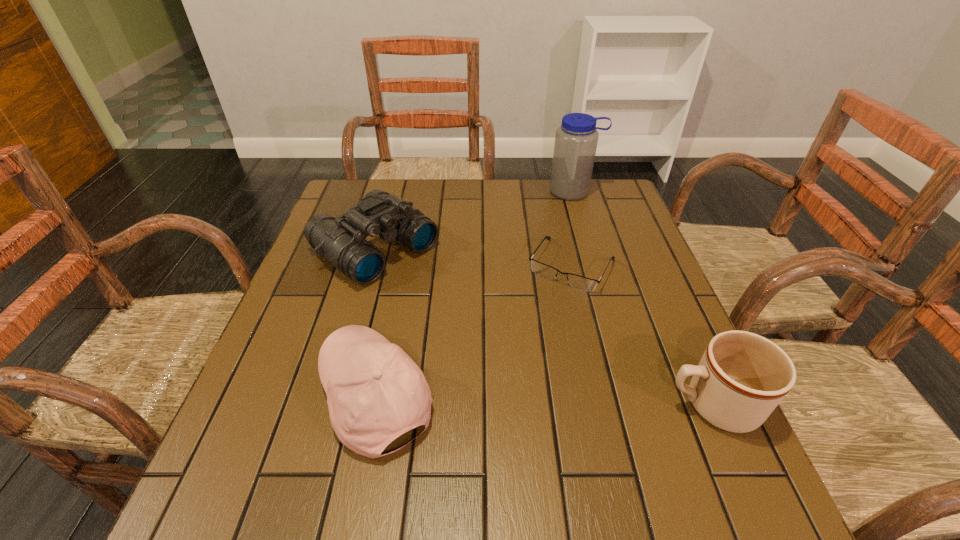
Find the location of a particular element. Image resolution: width=960 pixels, height=540 pixels. free space located 0.150m through the lenses of the binoculars is located at coordinates (457, 309).

Where is `blank space located through the lenses of the binoculars`? This screenshot has width=960, height=540. blank space located through the lenses of the binoculars is located at coordinates (513, 350).

Where is `vacant space located through the lenses of the binoculars`? This screenshot has height=540, width=960. vacant space located through the lenses of the binoculars is located at coordinates (467, 316).

Image resolution: width=960 pixels, height=540 pixels. In order to click on vacant point located with a carrying loop on the side of the water bottle in this screenshot , I will do `click(572, 260)`.

Where is `free region located with a carrying loop on the side of the water bottle`? free region located with a carrying loop on the side of the water bottle is located at coordinates (572, 231).

You are a GUI agent. You are given a task and a screenshot of the screen. Output one action in this format:
    pyautogui.click(x=<x>, y=<y>)
    Task: Click on the blank space located with a carrying loop on the side of the water bottle
    
    Given the screenshot: What is the action you would take?
    pyautogui.click(x=572, y=286)

Where is `vacant space located on the front-facing side of the shortest object`? vacant space located on the front-facing side of the shortest object is located at coordinates (536, 324).

At what (x,y) coordinates should I click in order to perform the action: click on free spot located on the front-facing side of the shortest object. Please return your answer as a coordinate pair (x, y). The image size is (960, 540). Looking at the image, I should click on (509, 370).

This screenshot has width=960, height=540. I want to click on vacant region located 0.370m on the front-facing side of the shortest object, so click(483, 413).

This screenshot has height=540, width=960. I want to click on binoculars present at the far edge, so click(342, 241).